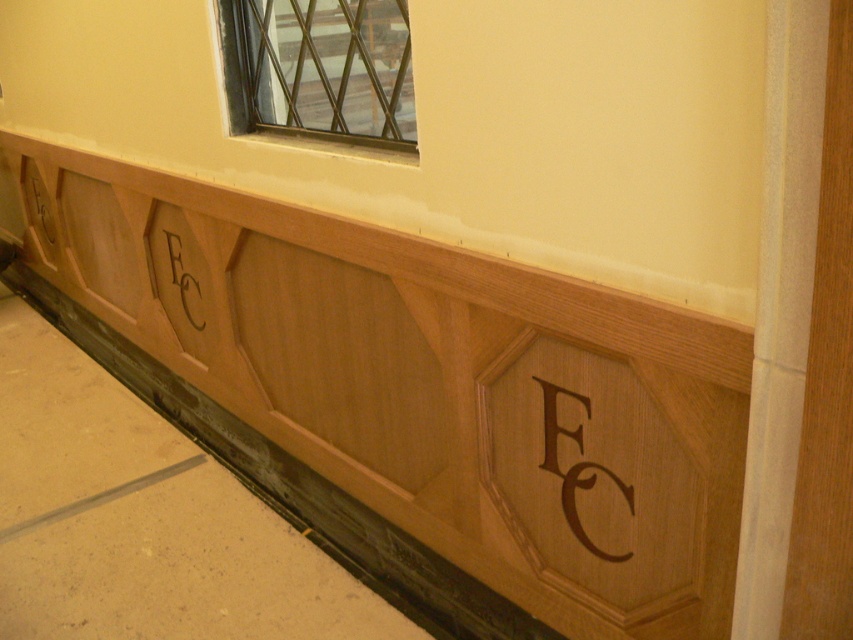
Question: Is metallic grid at upper center to the right of black wood lettering at center from the viewer's perspective?

Choices:
 (A) no
 (B) yes

Answer: (B)

Question: Does metallic grid at upper center have a lesser width compared to brown wood lettering at center?

Choices:
 (A) no
 (B) yes

Answer: (A)

Question: Is metallic grid at upper center to the right of black wood lettering at center from the viewer's perspective?

Choices:
 (A) yes
 (B) no

Answer: (A)

Question: Which object is positioned closest to the brown wood lettering at center?

Choices:
 (A) metallic grid at upper center
 (B) black wood lettering at center

Answer: (A)

Question: Which object appears closest to the camera in this image?

Choices:
 (A) black wood lettering at center
 (B) metallic grid at upper center
 (C) brown wood lettering at center

Answer: (C)

Question: Which object appears farthest from the camera in this image?

Choices:
 (A) metallic grid at upper center
 (B) black wood lettering at center

Answer: (B)